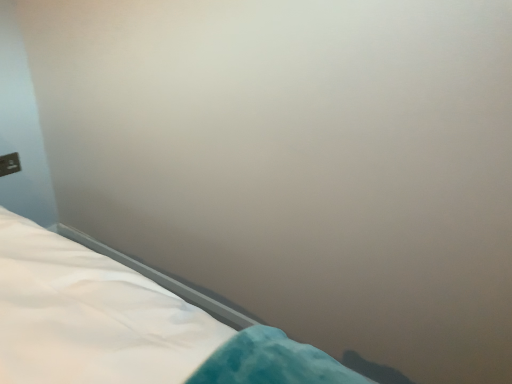
Locate an element on the screen. Image resolution: width=512 pixels, height=384 pixels. free space above white fabric bed at lower left (from a real-world perspective) is located at coordinates (168, 277).